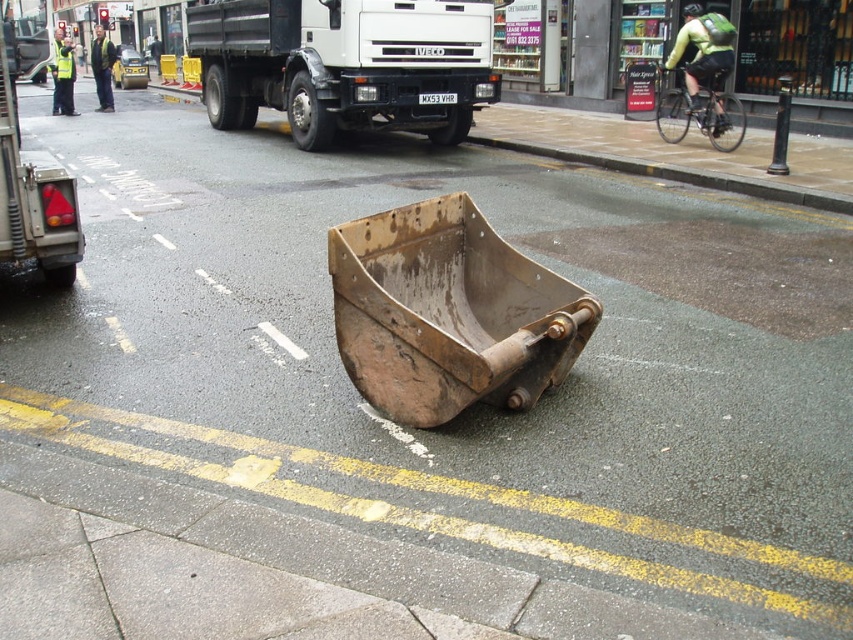
Question: Is green reflective jacket at upper right closer to camera compared to dark green jacket at upper left?

Choices:
 (A) yes
 (B) no

Answer: (A)

Question: Is white matte truck at upper center smaller than high visibility yellow jacket at upper left?

Choices:
 (A) yes
 (B) no

Answer: (A)

Question: Which of the following is the farthest from the observer?

Choices:
 (A) white matte truck at upper center
 (B) brown wooden bucket at center
 (C) green reflective jacket at upper right
 (D) dark green jacket at upper left

Answer: (D)

Question: Which point is closer to the camera?

Choices:
 (A) brown wooden bucket at center
 (B) high visibility yellow jacket at upper left
 (C) green reflective jacket at upper right

Answer: (A)

Question: From the image, what is the correct spatial relationship of high visibility yellow jacket at upper left in relation to dark green jacket at upper left?

Choices:
 (A) below
 (B) above

Answer: (B)

Question: Estimate the real-world distances between objects in this image. Which object is farther from the green reflective jacket at upper right?

Choices:
 (A) white matte truck at upper center
 (B) high visibility yellow jacket at upper left
 (C) dark green jacket at upper left

Answer: (B)